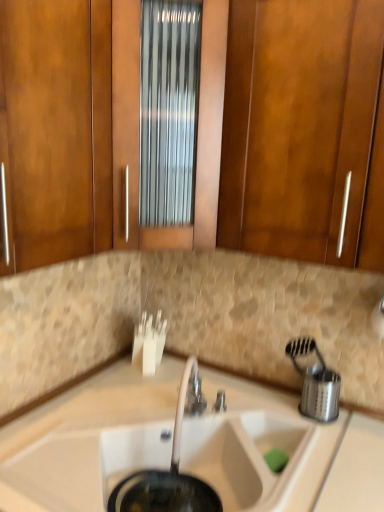
Question: Is wooden cabinet at center, the second cabinetry in the left-to-right sequence, next to white matte sink at center?

Choices:
 (A) yes
 (B) no

Answer: (B)

Question: From the image's perspective, is wooden cabinet at center, marked as the 1th cabinetry in a right-to-left arrangement, on white matte sink at center?

Choices:
 (A) no
 (B) yes

Answer: (B)

Question: From a real-world perspective, is wooden cabinet at center, marked as the 1th cabinetry in a right-to-left arrangement, located beneath white matte sink at center?

Choices:
 (A) yes
 (B) no

Answer: (B)

Question: Is the position of wooden cabinet at center, marked as the 1th cabinetry in a right-to-left arrangement, more distant than that of white matte sink at center?

Choices:
 (A) yes
 (B) no

Answer: (A)

Question: Could you tell me if wooden cabinet at center, the second cabinetry in the left-to-right sequence, is turned towards white matte sink at center?

Choices:
 (A) no
 (B) yes

Answer: (A)

Question: Is wooden cabinet at center, the second cabinetry in the left-to-right sequence, at the right side of white matte sink at center?

Choices:
 (A) yes
 (B) no

Answer: (B)

Question: From a real-world perspective, is wooden cabinet at center, the second cabinetry in the left-to-right sequence, located beneath silver metallic faucet at center?

Choices:
 (A) no
 (B) yes

Answer: (A)

Question: Is wooden cabinet at center, marked as the 1th cabinetry in a right-to-left arrangement, touching silver metallic faucet at center?

Choices:
 (A) yes
 (B) no

Answer: (B)

Question: Considering the relative sizes of wooden cabinet at center, marked as the 1th cabinetry in a right-to-left arrangement, and silver metallic faucet at center in the image provided, is wooden cabinet at center, marked as the 1th cabinetry in a right-to-left arrangement, shorter than silver metallic faucet at center?

Choices:
 (A) no
 (B) yes

Answer: (A)

Question: From the image's perspective, would you say wooden cabinet at center, marked as the 1th cabinetry in a right-to-left arrangement, is shown under silver metallic faucet at center?

Choices:
 (A) no
 (B) yes

Answer: (A)

Question: Is silver metallic faucet at center at the back of wooden cabinet at center, the second cabinetry in the left-to-right sequence?

Choices:
 (A) no
 (B) yes

Answer: (A)

Question: Is wooden cabinet at center, the second cabinetry in the left-to-right sequence, positioned far away from silver metallic faucet at center?

Choices:
 (A) yes
 (B) no

Answer: (B)

Question: Would you say white matte sink at center is a long distance from matte wood cabinet at upper center, which appears as the 1th cabinetry when viewed from the left?

Choices:
 (A) yes
 (B) no

Answer: (B)